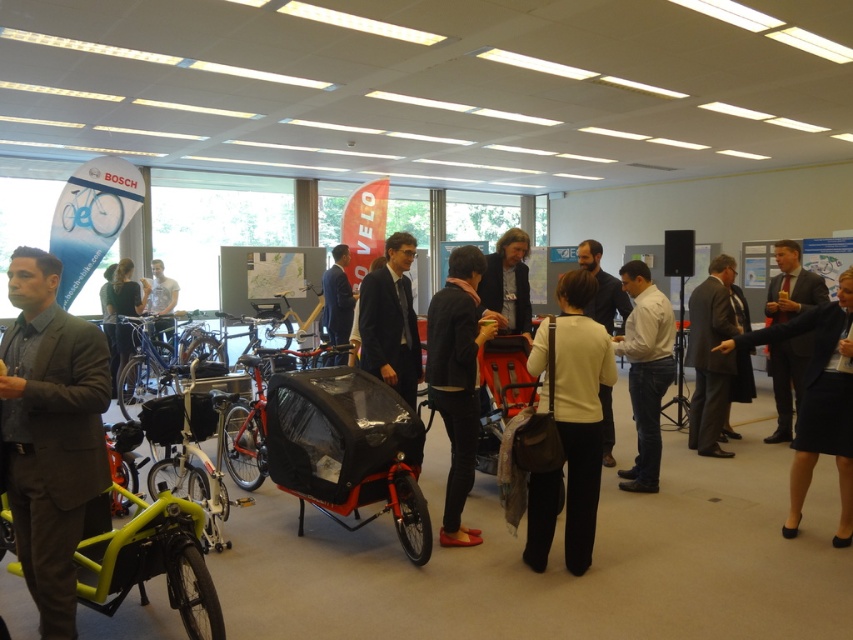
You are organizing a photo shoot in the event space and need to position two models wearing the white shirt at center and the matte black jacket at center. To ensure both fit within a single frame without overlapping, which model should stand closer to the camera and why?

The model wearing the white shirt at center should stand closer to the camera because its width is greater than the matte black jacket at center, allowing both to fit within the frame without overlapping.

You are organizing a display for an event and need to place the matte black cargo bike at center and the matte blue bicycle at upper left. Given their sizes, which bike should be placed closer to the entrance to ensure visibility?

The matte black cargo bike at center is larger in size than the matte blue bicycle at upper left, so placing the larger matte black cargo bike at center closer to the entrance will ensure better visibility due to its size.

You are standing in the event space and want to locate the white shirt at center. Based on the coordinates provided, where would you look to find it?

The white shirt at center is located at the 2D coordinates point (645, 371), which is approximately the center of the image.